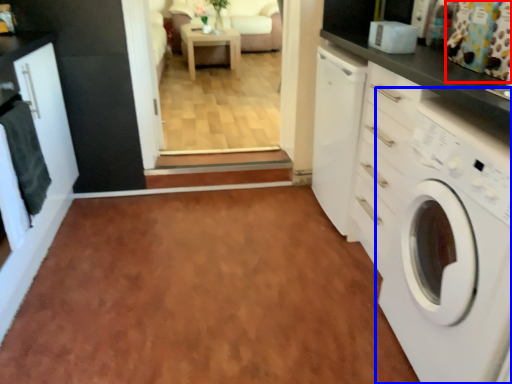
Question: Among these objects, which one is farthest to the camera, curtain (highlighted by a red box) or washing machine (highlighted by a blue box)?

Choices:
 (A) curtain
 (B) washing machine

Answer: (A)